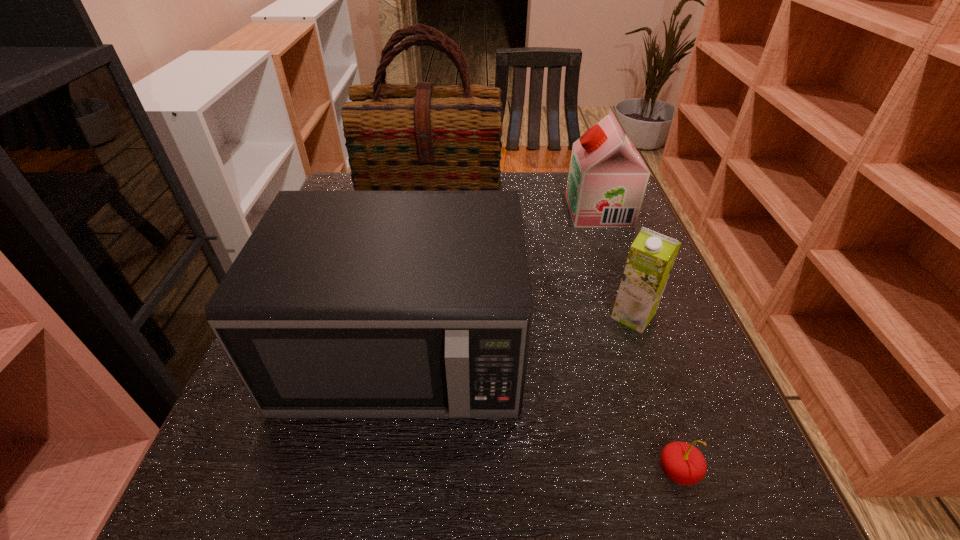
Locate an element on the screen. This screenshot has width=960, height=540. vacant region located with the cap open on the farther soya milk is located at coordinates (517, 211).

At what (x,y) coordinates should I click in order to perform the action: click on free space located on the front-facing side of the microwave oven. Please return your answer as a coordinate pair (x, y). Looking at the image, I should click on (373, 533).

Where is `free point located on the left of the fourth tallest object`? free point located on the left of the fourth tallest object is located at coordinates (546, 316).

Where is `vacant area located 0.120m on the left of the shortest object`? vacant area located 0.120m on the left of the shortest object is located at coordinates (577, 471).

Identify the location of shopping bag present at the far edge. (398, 137).

The height and width of the screenshot is (540, 960). Find the location of `soya milk that is at the far edge`. soya milk that is at the far edge is located at coordinates (607, 179).

Where is `object positioned at the near edge`? The image size is (960, 540). object positioned at the near edge is located at coordinates (681, 462).

The width and height of the screenshot is (960, 540). Find the location of `shopping bag at the left edge`. shopping bag at the left edge is located at coordinates (398, 137).

Image resolution: width=960 pixels, height=540 pixels. I want to click on microwave oven located in the left edge section of the desktop, so click(x=342, y=304).

Where is `cherry present at the right edge`? The height and width of the screenshot is (540, 960). cherry present at the right edge is located at coordinates (681, 462).